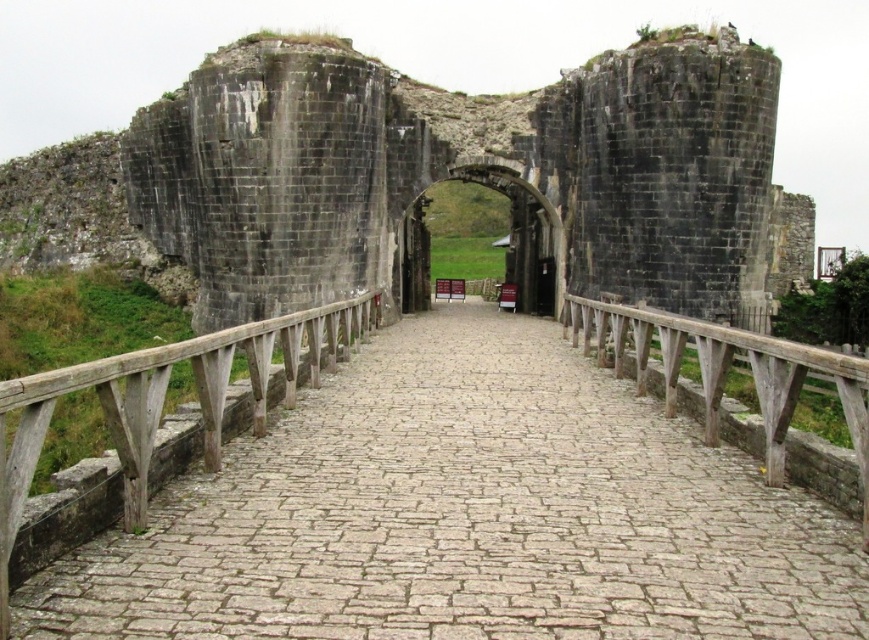
You are a tour guide leading a group to the historic stone archway. You notice a smooth stone path at center and a weathered wood rail at center. Which one is wider?

The smooth stone path at center is wider than the weathered wood rail at center according to the description.